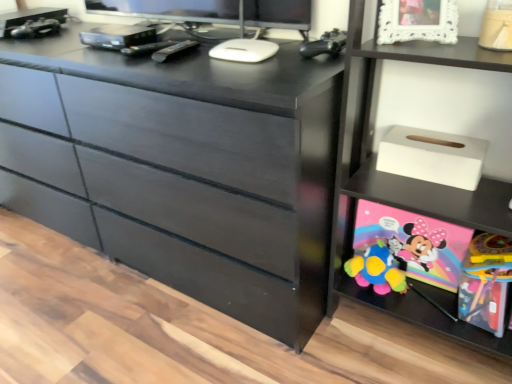
The height and width of the screenshot is (384, 512). Find the location of `free space in front of black plastic remote at center`. free space in front of black plastic remote at center is located at coordinates (195, 69).